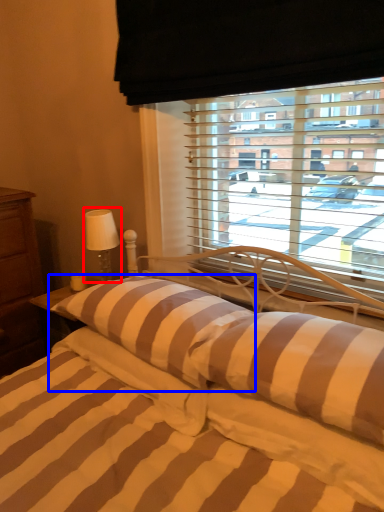
Question: Among these objects, which one is nearest to the camera, table lamp (highlighted by a red box) or pillow (highlighted by a blue box)?

Choices:
 (A) table lamp
 (B) pillow

Answer: (B)